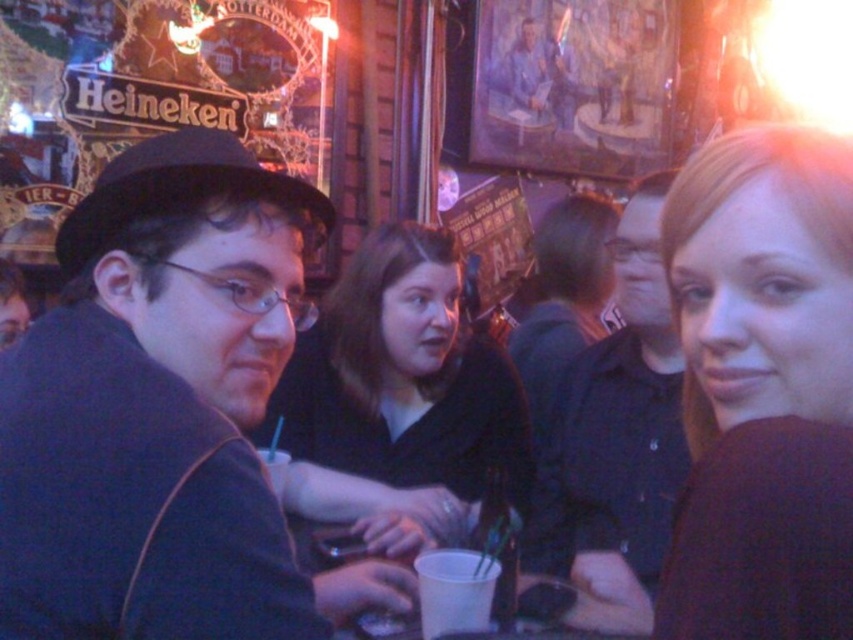
You are standing in the bar and see a point marked at coordinates (763,387). According to the scene description, what object is this point located on?

The point at coordinates (763,387) is located on the smooth maroon sweater at right.

You are a photographer taking a picture of the scene. You want to focus on the smooth maroon sweater at right and the matte black shirt at center. Which one will be more in the foreground of your photo?

The smooth maroon sweater at right is in front of the matte black shirt at center, so it will be more in the foreground of the photo.